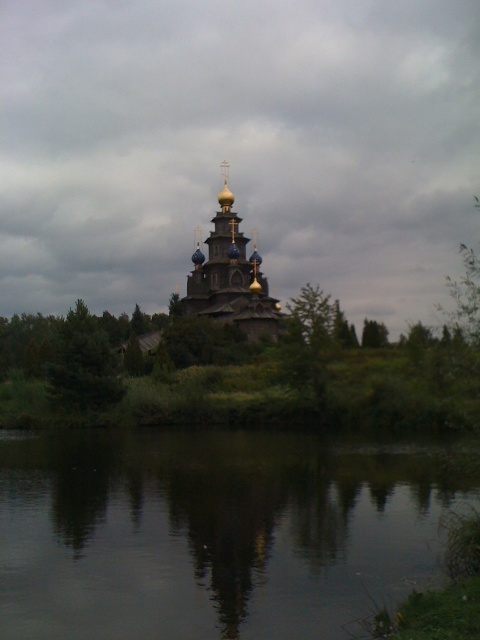
Is point (244, 330) in front of point (382, 333)?

That is False.

Is gold domed church at center wider than green leafy tree at center?

Yes.

At what (x,y) coordinates should I click in order to perform the action: click on gold domed church at center. Please return your answer as a coordinate pair (x, y). The height and width of the screenshot is (640, 480). Looking at the image, I should click on (230, 276).

Which is below, greenish reflective water at lower center or green leafy tree at center?

greenish reflective water at lower center is below.

Locate an element on the screen. The image size is (480, 640). greenish reflective water at lower center is located at coordinates (214, 531).

Is point (457, 486) positioned after point (373, 330)?

No, it is not.

Locate an element on the screen. The height and width of the screenshot is (640, 480). greenish reflective water at lower center is located at coordinates (214, 531).

Can you confirm if green matte tree at left is shorter than green leafy tree at center?

Incorrect, green matte tree at left's height does not fall short of green leafy tree at center's.

Is point (66, 353) closer to viewer compared to point (365, 324)?

Yes.

Where is `green matte tree at left`? The height and width of the screenshot is (640, 480). green matte tree at left is located at coordinates (83, 364).